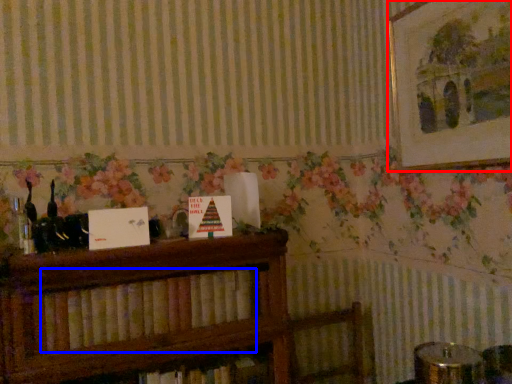
Question: Which point is closer to the camera, picture frame (highlighted by a red box) or book (highlighted by a blue box)?

Choices:
 (A) picture frame
 (B) book

Answer: (B)